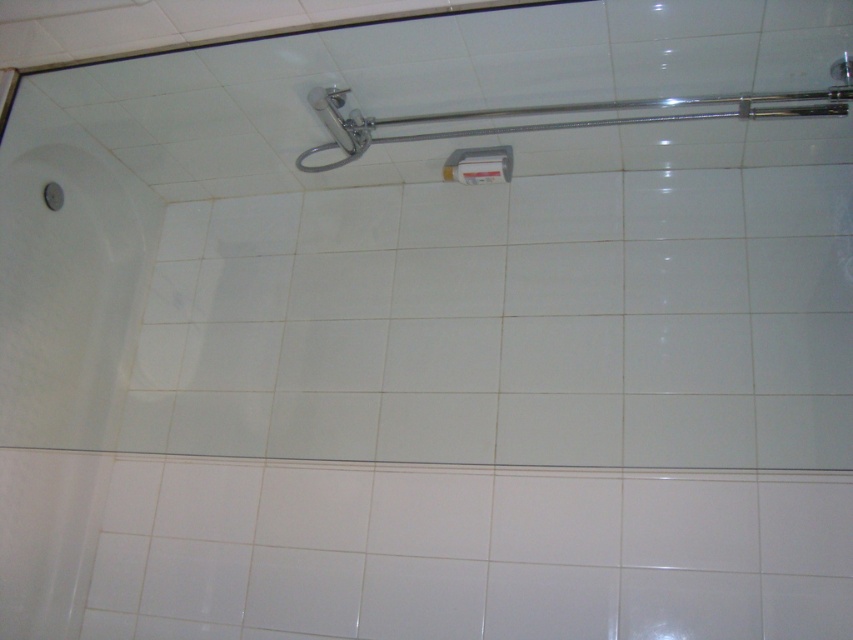
You are a plumber inspecting a bathroom shower installation. You notice a point at coordinate (560, 116) in the image. Based on the scene description, what object is located at this coordinate?

The point at coordinate (560, 116) indicates the chrome metallic shower arm at upper center.

You are standing in the bathroom and want to place a small plant between the two points, point (x=543, y=106) and point (x=445, y=163). Which point should the plant be closer to so it is in front of the other point?

The plant should be closer to point (x=543, y=106) because it is in front of point (x=445, y=163).